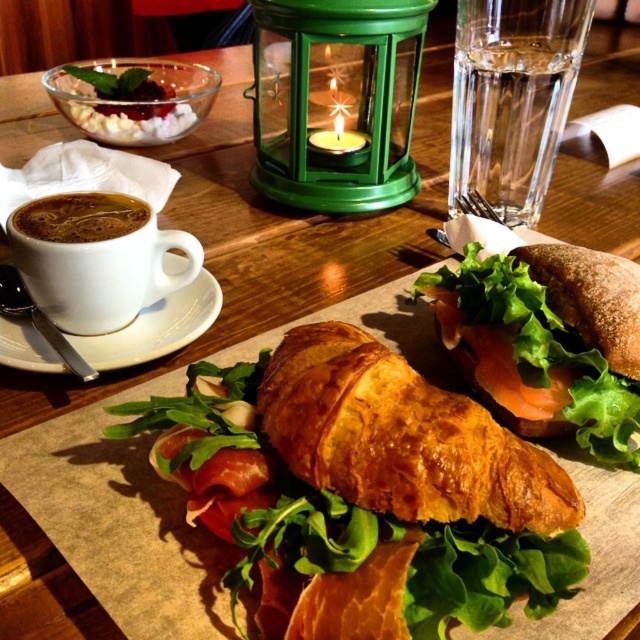
Between golden brown flaky croissant at center and brown matte cup at upper left, which one has more height?

Answer: Standing taller between the two is brown matte cup at upper left.

Does point (353, 417) lie in front of point (141, 307)?

Yes, point (353, 417) is in front of point (141, 307).

Which is in front, point (355, 497) or point (29, 253)?

Point (355, 497)

Where is `golden brown flaky croissant at center`? Image resolution: width=640 pixels, height=640 pixels. golden brown flaky croissant at center is located at coordinates (403, 436).

From the picture: Can you confirm if brown matte cup at upper left is positioned to the left of white ceramic cup at upper left?

Yes, brown matte cup at upper left is to the left of white ceramic cup at upper left.

Can you confirm if brown matte cup at upper left is positioned to the right of white ceramic cup at upper left?

Incorrect, brown matte cup at upper left is not on the right side of white ceramic cup at upper left.

Which is behind, point (132, 289) or point (220, 307)?

The point (220, 307) is behind.

Identify the location of brown matte cup at upper left. (96, 259).

Which is below, golden brown flaky croissant at center or white ceramic cup at upper left?

Positioned lower is golden brown flaky croissant at center.

Identify the location of golden brown flaky croissant at center. point(403,436).

Where is `golden brown flaky croissant at center`? The height and width of the screenshot is (640, 640). golden brown flaky croissant at center is located at coordinates pyautogui.click(x=403, y=436).